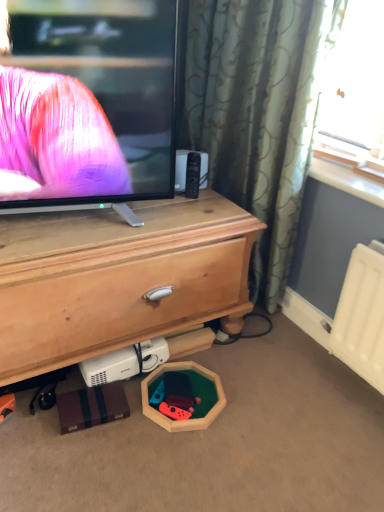
Question: Considering the positions of point (142, 406) and point (192, 411), is point (142, 406) closer or farther from the camera than point (192, 411)?

Choices:
 (A) farther
 (B) closer

Answer: (A)

Question: From the image's perspective, is wooden hexagon at lower center, which ranks as the second toy in left-to-right order, located above or below wooden hexagon at lower center, the second toy when ordered from right to left?

Choices:
 (A) above
 (B) below

Answer: (B)

Question: Based on their relative distances, which object is farther from the wooden hexagon at lower center, acting as the 1th toy starting from the right?

Choices:
 (A) wooden hexagon at lower center, the 1th toy viewed from the left
 (B) wooden chest of drawers at center

Answer: (B)

Question: Which of these objects is positioned farthest from the wooden chest of drawers at center?

Choices:
 (A) wooden hexagon at lower center, the 1th toy viewed from the left
 (B) wooden hexagon at lower center, acting as the 1th toy starting from the right

Answer: (A)